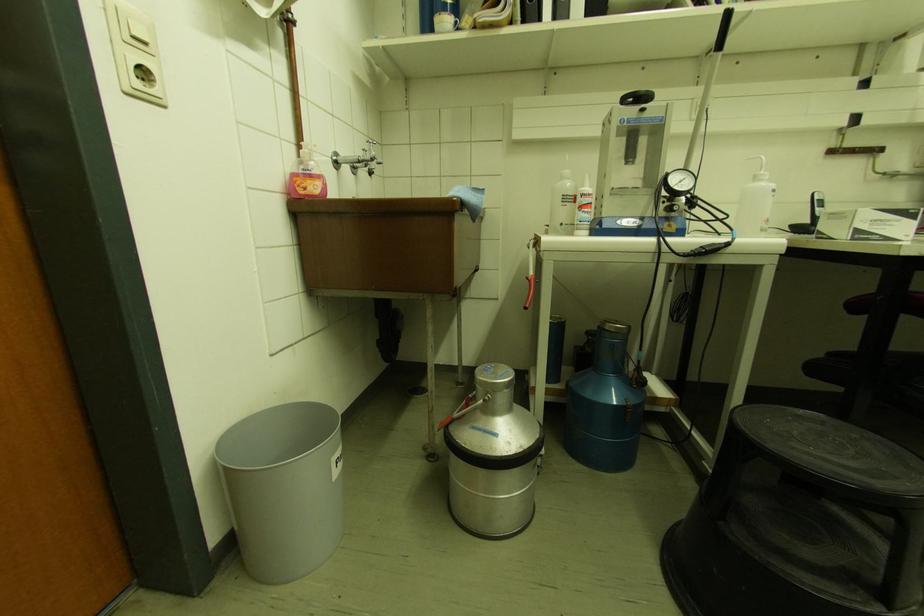
What do you see at coordinates (371, 146) in the screenshot? I see `the faucet handle` at bounding box center [371, 146].